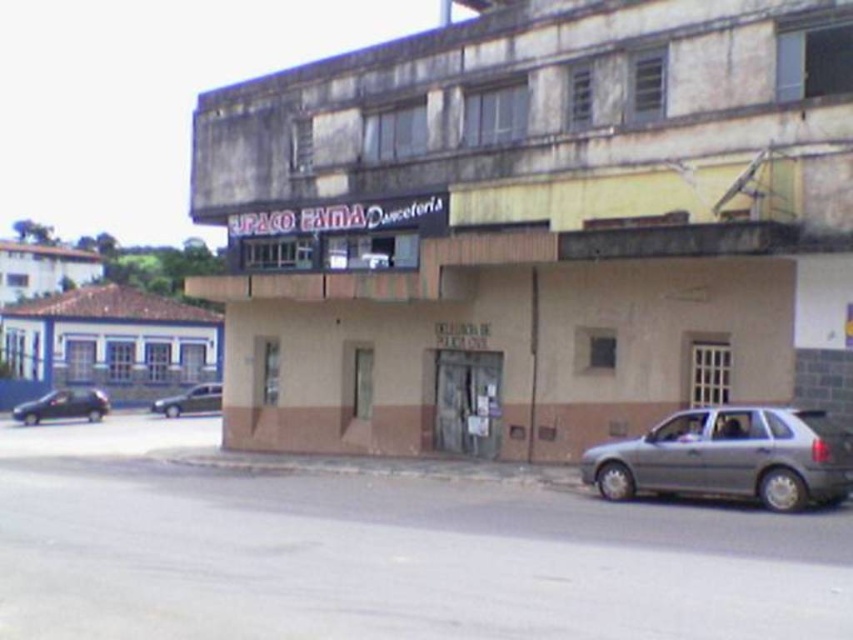
You are a delivery person needing to park your 15 feet long truck between the shiny black sedan at lower left and the metallic silver sedan at lower left. Can you fit your truck there?

The distance between the shiny black sedan at lower left and the metallic silver sedan at lower left is 17.48 feet. Since your truck is 15 feet long, it can fit in the space between them.

You are a delivery driver who needs to park your vehicle, a satin silver hatchback at lower right, in a designated parking spot located at point 0.716, 0.857. Can you confirm if your vehicle is already parked in the correct spot?

Yes, the satin silver hatchback at lower right is already parked at point (730, 458), so it is in the correct designated parking spot.

You are a delivery person needing to park your van between the satin silver hatchback at lower right and the metallic silver sedan at lower left. The van requires a parking space of at least 50 meters. Can you fit your van between them?

The distance between the satin silver hatchback at lower right and the metallic silver sedan at lower left is 40.90 meters, which is less than the required 50 meters. Therefore, the van cannot be parked between them.